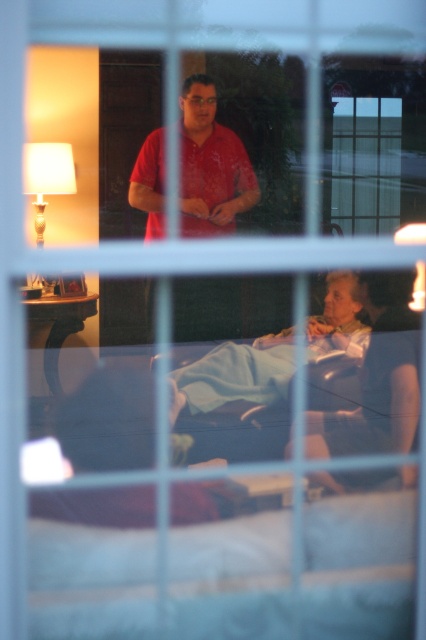
Question: Which of these objects is positioned closest to the light blue fabric at lower center?

Choices:
 (A) matte red shirt at center
 (B) light blue fabric at lower right

Answer: (B)

Question: Estimate the real-world distances between objects in this image. Which object is farther from the light blue fabric at lower right?

Choices:
 (A) matte red shirt at center
 (B) light blue fabric at lower center

Answer: (A)

Question: Does matte red shirt at center appear under light blue fabric at lower center?

Choices:
 (A) yes
 (B) no

Answer: (B)

Question: Can you confirm if light blue fabric at lower right is positioned above light blue fabric at lower center?

Choices:
 (A) no
 (B) yes

Answer: (A)

Question: Does light blue fabric at lower right lie behind light blue fabric at lower center?

Choices:
 (A) yes
 (B) no

Answer: (A)

Question: Which object appears closest to the camera in this image?

Choices:
 (A) light blue fabric at lower center
 (B) light blue fabric at lower right

Answer: (A)